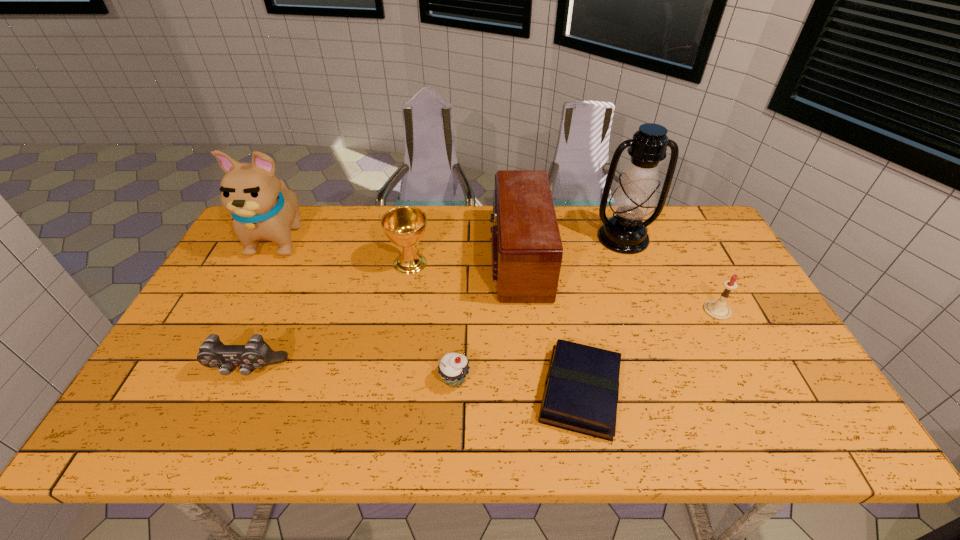
Find the location of a particular element. vacant space at the far right corner of the desktop is located at coordinates (673, 210).

You are a GUI agent. You are given a task and a screenshot of the screen. Output one action in this format:
    pyautogui.click(x=<x>, y=<y>)
    Task: Click on the vacant space in between the control and the oil lamp
    The image size is (960, 540).
    Given the screenshot: What is the action you would take?
    pyautogui.click(x=435, y=304)

Where is `unoccupied area between the puppy and the cupcake`? This screenshot has width=960, height=540. unoccupied area between the puppy and the cupcake is located at coordinates (368, 308).

Identify the location of free spot between the book and the control. (414, 381).

At what (x,y) coordinates should I click in order to perform the action: click on empty space between the third object from left to right and the book. Please return your answer as a coordinate pair (x, y). The image size is (960, 540). Looking at the image, I should click on (495, 328).

You are a GUI agent. You are given a task and a screenshot of the screen. Output one action in this format:
    pyautogui.click(x=<x>, y=<y>)
    Task: Click on the free space between the fifth object from right to left and the control
    The width and height of the screenshot is (960, 540).
    Given the screenshot: What is the action you would take?
    tap(351, 375)

Find the location of a particular element. The width and height of the screenshot is (960, 540). vacant point located between the rightmost object and the oil lamp is located at coordinates (670, 274).

The height and width of the screenshot is (540, 960). What are the coordinates of `vacant region between the fifth object from right to left and the shortest object` in the screenshot? It's located at (517, 386).

What are the coordinates of `empty space that is in between the oil lamp and the candle` in the screenshot? It's located at (670, 274).

Identify the location of free point between the second object from right to left and the sixth shortest object. (570, 248).